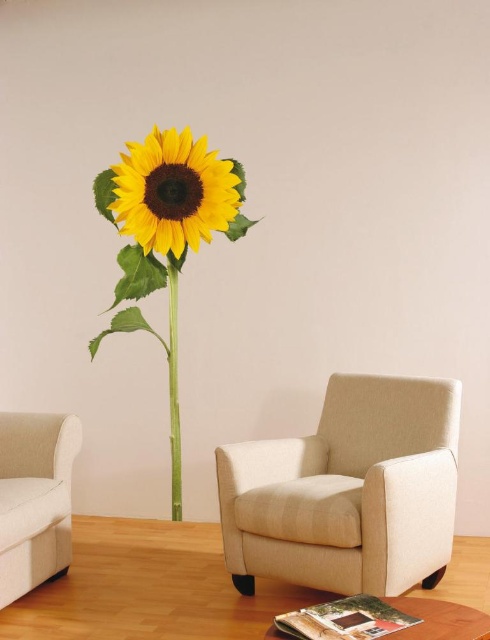
Question: In this image, where is beige fabric armchair at center located relative to green matte stem at center?

Choices:
 (A) above
 (B) below

Answer: (B)

Question: Which point is closer to the camera?

Choices:
 (A) (174, 193)
 (B) (460, 627)

Answer: (B)

Question: Is beige fabric armchair at center further to camera compared to wooden round table at lower center?

Choices:
 (A) yes
 (B) no

Answer: (A)

Question: Is beige fabric couch at left thinner than yellow matte sunflower at upper center?

Choices:
 (A) no
 (B) yes

Answer: (B)

Question: Which of the following is the closest to the observer?

Choices:
 (A) green matte stem at center
 (B) beige fabric armchair at center

Answer: (B)

Question: Which point is farther to the camera?

Choices:
 (A) (171, 296)
 (B) (8, 490)
 (C) (140, 241)

Answer: (A)